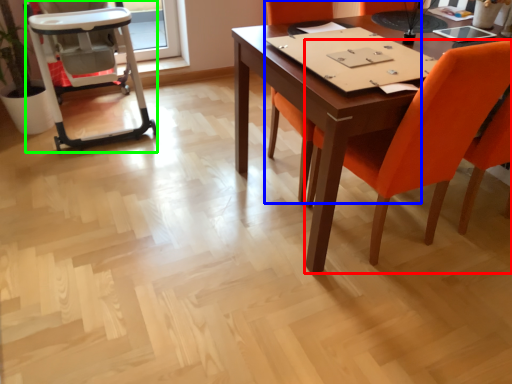
Question: Estimate the real-world distances between objects in this image. Which object is farther from chair (highlighted by a red box), chair (highlighted by a blue box) or armchair (highlighted by a green box)?

Choices:
 (A) chair
 (B) armchair

Answer: (B)